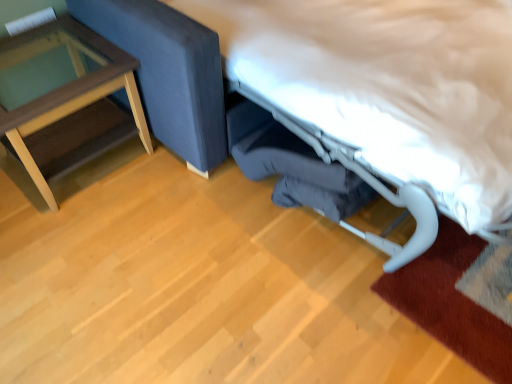
Measure the distance between point (401, 185) and camera.

They are 1.33 meters apart.

What do you see at coordinates (389, 91) in the screenshot?
I see `white fabric bed at center` at bounding box center [389, 91].

What are the coordinates of `white fabric bed at center` in the screenshot? It's located at 389,91.

What do you see at coordinates (68, 85) in the screenshot? I see `transparent glass table at left` at bounding box center [68, 85].

Measure the distance between transparent glass table at left and camera.

The depth of transparent glass table at left is 1.52 meters.

In order to click on transparent glass table at left in this screenshot , I will do `click(68, 85)`.

In order to face transparent glass table at left, should I rotate leftwards or rightwards?

You should look left and rotate roughly 25.118 degrees.

In order to click on white fabric bed at center in this screenshot , I will do `click(389, 91)`.

Would you say transparent glass table at left is to the left or to the right of white fabric bed at center in the picture?

In the image, transparent glass table at left appears on the left side of white fabric bed at center.

Which object is more forward, transparent glass table at left or white fabric bed at center?

white fabric bed at center is in front.

Considering the positions of point (65, 25) and point (281, 86), is point (65, 25) closer or farther from the camera than point (281, 86)?

Clearly, point (65, 25) is more distant from the camera than point (281, 86).

From the image's perspective, between transparent glass table at left and white fabric bed at center, which one is located above?

white fabric bed at center, from the image's perspective.

From a real-world perspective, is transparent glass table at left positioned under white fabric bed at center based on gravity?

Yes, from a real-world perspective, transparent glass table at left is under white fabric bed at center.

Can you confirm if transparent glass table at left is wider than white fabric bed at center?

No.

In terms of height, does transparent glass table at left look taller or shorter compared to white fabric bed at center?

In the image, transparent glass table at left appears to be shorter than white fabric bed at center.

Can you confirm if transparent glass table at left is bigger than white fabric bed at center?

No, transparent glass table at left is not bigger than white fabric bed at center.

Which is correct: transparent glass table at left is inside white fabric bed at center, or outside of it?

transparent glass table at left is not inside white fabric bed at center, it's outside.

Are transparent glass table at left and white fabric bed at center far apart?

No, transparent glass table at left is in close proximity to white fabric bed at center.

Is transparent glass table at left turned away from white fabric bed at center?

No.

Locate an element on the screen. The image size is (512, 384). bed in front of the transparent glass table at left is located at coordinates (389, 91).

Which is more to the left, white fabric bed at center or transparent glass table at left?

transparent glass table at left.

Is white fabric bed at center in front of or behind transparent glass table at left in the image?

In the image, white fabric bed at center appears in front of transparent glass table at left.

Which is behind, point (302, 85) or point (44, 37)?

The point (44, 37) is more distant.

From the image's perspective, is white fabric bed at center under transparent glass table at left?

No.

From a real-world perspective, who is located lower, white fabric bed at center or transparent glass table at left?

transparent glass table at left.

Considering the relative sizes of white fabric bed at center and transparent glass table at left in the image provided, is white fabric bed at center wider than transparent glass table at left?

Indeed, white fabric bed at center has a greater width compared to transparent glass table at left.

Who is shorter, white fabric bed at center or transparent glass table at left?

transparent glass table at left.

Who is smaller, white fabric bed at center or transparent glass table at left?

transparent glass table at left.

Is white fabric bed at center not inside transparent glass table at left?

white fabric bed at center lies outside transparent glass table at left's area.

In the scene shown: Does white fabric bed at center touch transparent glass table at left?

white fabric bed at center and transparent glass table at left are clearly separated.

Is white fabric bed at center looking in the opposite direction of transparent glass table at left?

white fabric bed at center is not turned away from transparent glass table at left.

Identify the location of table behind the white fabric bed at center. The height and width of the screenshot is (384, 512). (x=68, y=85).

In order to click on table behind the white fabric bed at center in this screenshot , I will do `click(68, 85)`.

Locate an element on the screen. The image size is (512, 384). table that is under the white fabric bed at center (from a real-world perspective) is located at coordinates (68, 85).